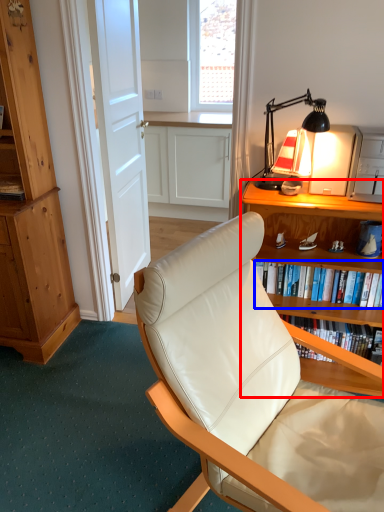
Question: Which of the following is the farthest to the observer, desk (highlighted by a red box) or book (highlighted by a blue box)?

Choices:
 (A) desk
 (B) book

Answer: (B)